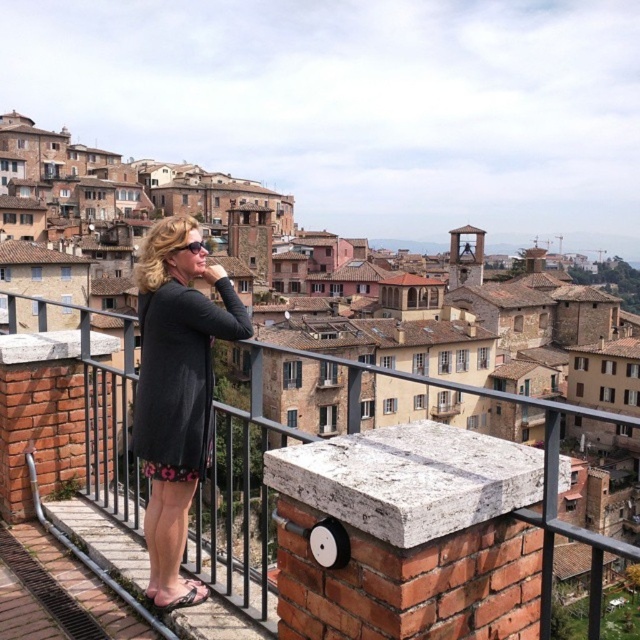
Question: Which point is closer to the camera?

Choices:
 (A) (145, 456)
 (B) (97, 433)

Answer: (A)

Question: Based on their relative distances, which object is farther from the black metal/rail at upper center?

Choices:
 (A) floral print fabric dress at center
 (B) dark gray dress at center

Answer: (B)

Question: Estimate the real-world distances between objects in this image. Which object is closer to the black metal/rail at upper center?

Choices:
 (A) dark gray dress at center
 (B) floral print fabric dress at center

Answer: (B)

Question: Does black metal/rail at upper center come in front of floral print fabric dress at center?

Choices:
 (A) yes
 (B) no

Answer: (A)

Question: Observing the image, what is the correct spatial positioning of black metal/rail at upper center in reference to dark gray dress at center?

Choices:
 (A) left
 (B) right

Answer: (B)

Question: Can you confirm if dark gray dress at center is positioned to the right of floral print fabric dress at center?

Choices:
 (A) yes
 (B) no

Answer: (A)